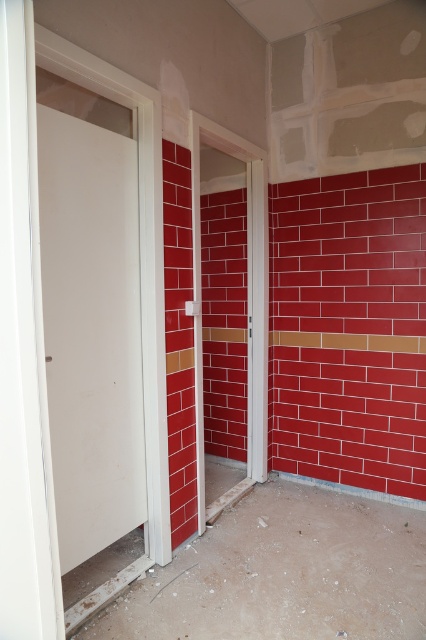
You are a delivery person trying to enter the room through the correct door. The instructions say to use the door that is higher up. Which door should you choose between the white matte door at left and the white glossy door at center?

The white glossy door at center is higher up, so you should choose the white glossy door at center.

You are a delivery person standing at point (92,332) in the room. You need to deliver a package to the white door frame leading into another room. Can you reach the white door frame from your current position without moving past the exposed plasterboard at top right corner?

The white matte door at left is located at point (92,332), so you are already at the white door frame leading into another room and can deliver the package there without moving past the exposed plasterboard at top right corner.